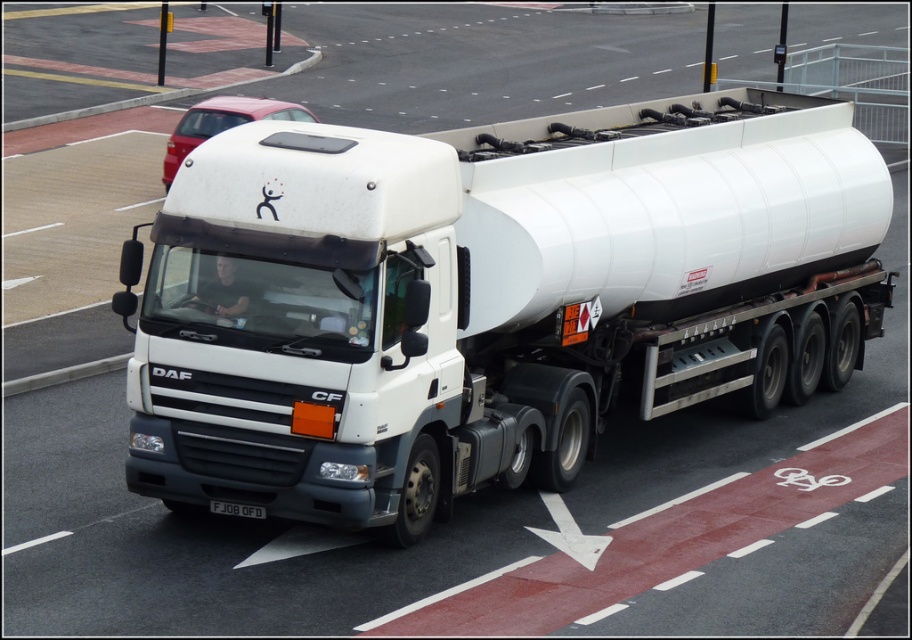
In the scene shown: You are a truck driver planning to park the tanker truck in a designated area. The parking area has two marked spots represented by the coordinates point (177,404) and point (237,508). Based on the truck route, which parking spot should you aim for first?

Point (177,404) is in front of point (237,508), so you should aim for point (177,404) first as it is closer to the truck.

You are a traffic officer observing a DAF CF tanker truck on the road. You notice the white matte tanker at center and the white plastic license plate at center. Based on their positions, which object is closer to the left side of the truck?

The white matte tanker at center is to the left of the white plastic license plate at center, so the white matte tanker at center is closer to the left side of the truck.

You are a driver who needs to read the license plate of the white plastic license plate at center while avoiding the metallic red car at upper center. Which direction should you move your vehicle to get a clear view?

The metallic red car at upper center is positioned on the left side of the white plastic license plate at center. To avoid the metallic red car at upper center and get a clear view of the white plastic license plate at center, you should move your vehicle to the right side.